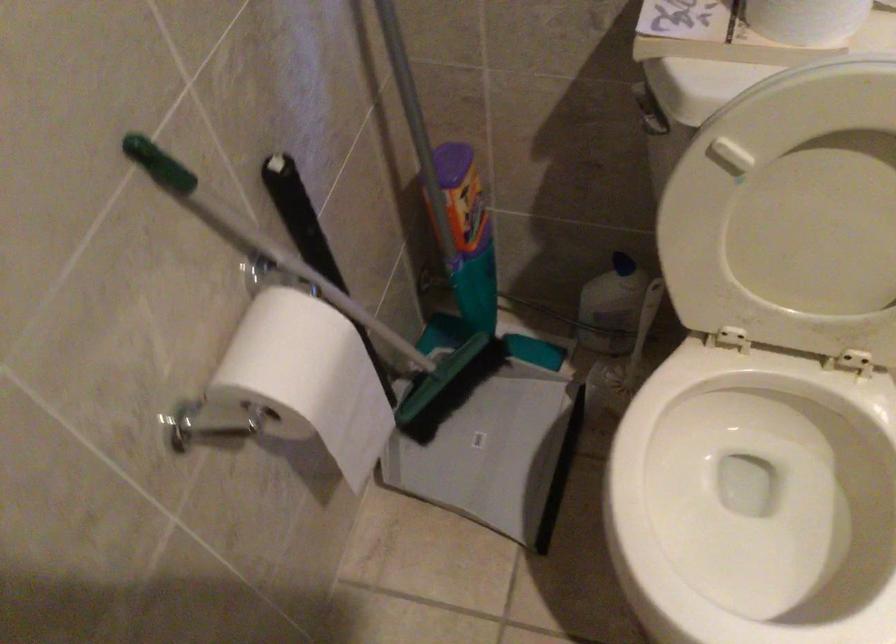
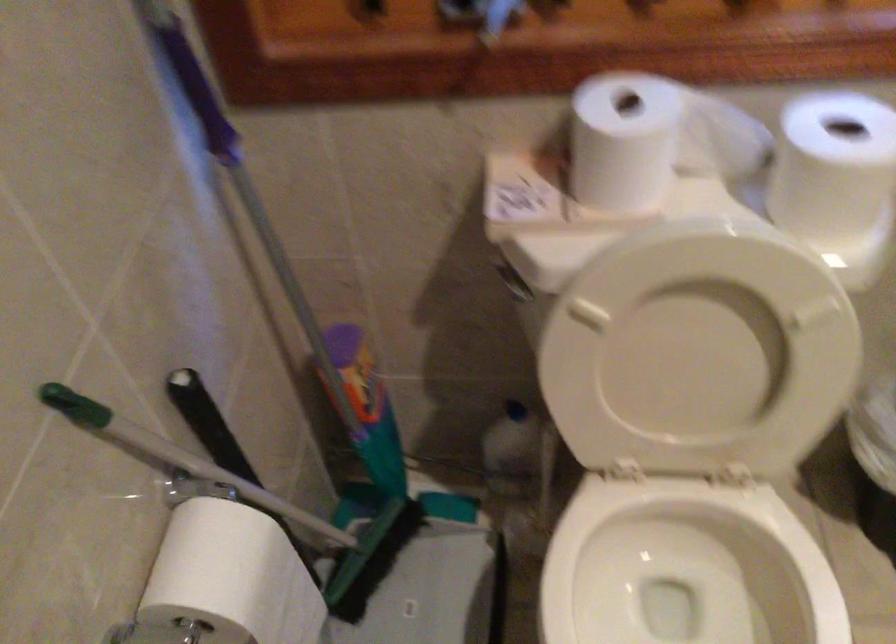
In the second image, find the point that corresponds to pixel 263 240 in the first image.

(177, 457)